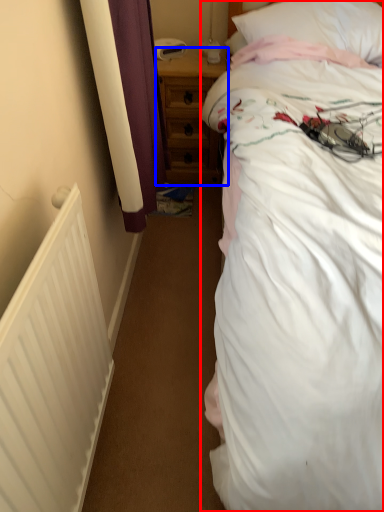
Question: Which of the following is the closest to the observer, bed (highlighted by a red box) or nightstand (highlighted by a blue box)?

Choices:
 (A) bed
 (B) nightstand

Answer: (A)